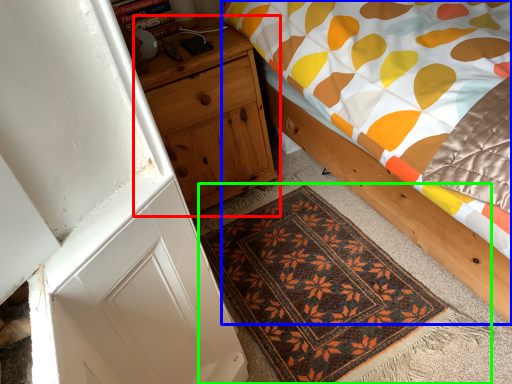
Question: Which object is positioned closest to nightstand (highlighted by a red box)? Select from bed (highlighted by a blue box) and mat (highlighted by a green box).

Choices:
 (A) bed
 (B) mat

Answer: (A)